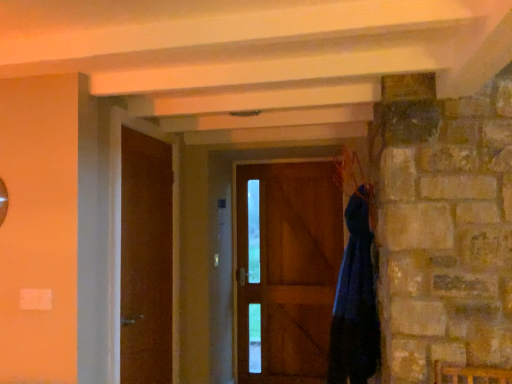
Question: In terms of width, does dark blue fabric at right look wider or thinner when compared to wooden door at center, which is counted as the second door, starting from the left?

Choices:
 (A) wide
 (B) thin

Answer: (A)

Question: Is dark blue fabric at right to the left or to the right of wooden door at center, acting as the first door starting from the back, in the image?

Choices:
 (A) right
 (B) left

Answer: (A)

Question: Estimate the real-world distances between objects in this image. Which object is closer to the dark blue fabric at right?

Choices:
 (A) matte brown door at left, which ranks as the second door in back-to-front order
 (B) wooden door at center, the second door viewed from the front

Answer: (A)

Question: Which of these objects is positioned farthest from the dark blue fabric at right?

Choices:
 (A) wooden door at center, acting as the first door starting from the back
 (B) matte brown door at left, the 1th door positioned from the front

Answer: (A)